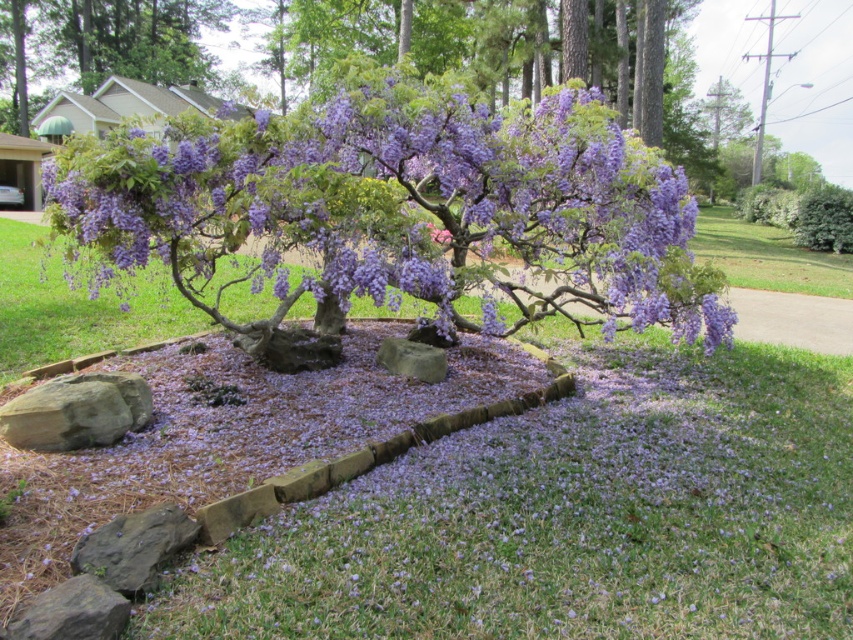
Question: Can you confirm if gray rough rock at lower left is thinner than gray rock at center?

Choices:
 (A) no
 (B) yes

Answer: (B)

Question: Is purple flower bed at center to the left of gray rough rock at lower left from the viewer's perspective?

Choices:
 (A) yes
 (B) no

Answer: (A)

Question: Which of the following is the closest to the observer?

Choices:
 (A) (381, 604)
 (B) (416, 371)

Answer: (A)

Question: Can you confirm if purple gravel at center is thinner than brown rough rock at lower left?

Choices:
 (A) no
 (B) yes

Answer: (A)

Question: Which of the following is the closest to the observer?

Choices:
 (A) purple flower bed at center
 (B) purple matte flowers at center
 (C) gray rough rock at lower left

Answer: (C)

Question: Based on their relative distances, which object is nearer to the purple flower bed at center?

Choices:
 (A) purple gravel at center
 (B) gray rock at center
 (C) purple matte flowers at center

Answer: (A)